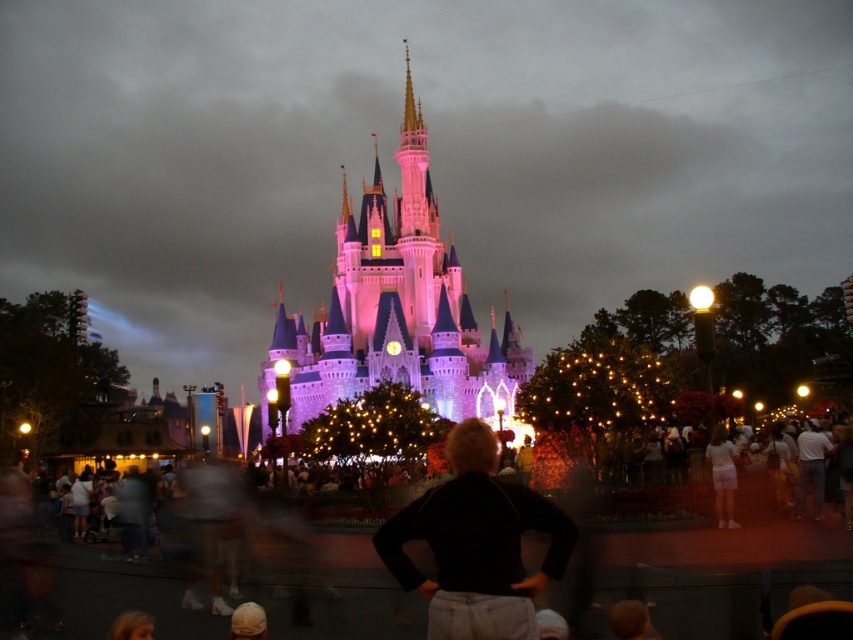
You are standing in the theme park and want to take a photo of both the castle and the festive decorations. You notice two points marked in the image. The first point is at coordinates point (393, 225) and the second is at point (503, 524). Which point is closer to you, the photographer?

Point (503, 524) is closer to you because the description states that point (393, 225) is further to the camera than point (503, 524).

You are standing in the theme park and want to take a photo of both the castle and a specific spot marked by point (x=415, y=573). However, there is another point at (x=718, y=449) that might block your view. Based on their positions, which point is closer to you and should be in focus first?

Point (x=415, y=573) is closer to the camera than point (x=718, y=449), so it should be in focus first to ensure both the castle and the specific spot are visible.